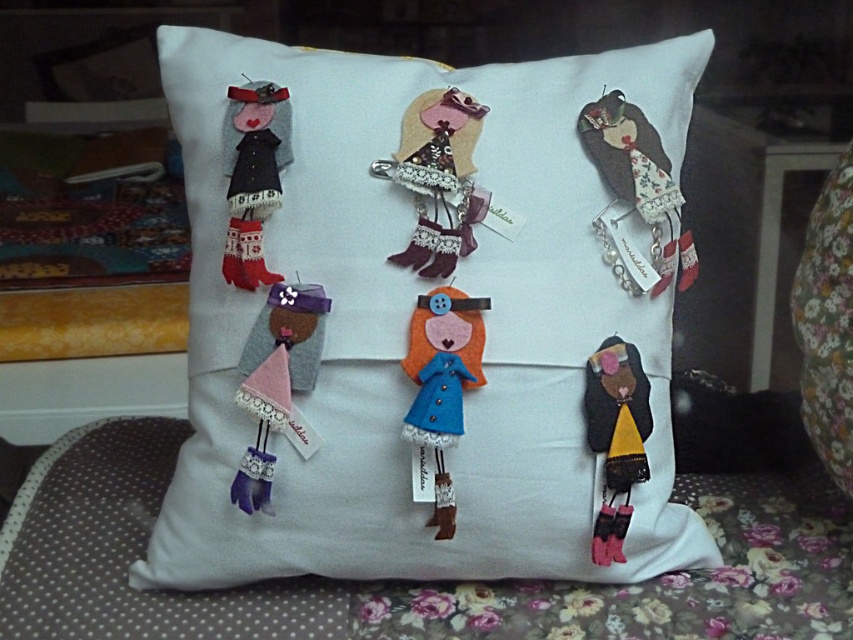
Question: Which point is closer to the camera?

Choices:
 (A) dark brown felt doll at lower right
 (B) white felt pillow at center
 (C) brown felt doll at upper right
 (D) blue felt doll at center

Answer: (D)

Question: Which of these objects is positioned closest to the blue felt doll at center?

Choices:
 (A) brown felt doll at upper right
 (B) pink felt doll at center
 (C) felt doll at upper left

Answer: (B)

Question: In this image, where is white felt pillow at center located relative to brown felt doll at upper right?

Choices:
 (A) above
 (B) below

Answer: (B)

Question: Based on their relative distances, which object is farther from the white felt pillow at center?

Choices:
 (A) blue felt doll at center
 (B) felt doll at upper left
 (C) brown felt doll at upper right

Answer: (C)

Question: Can you confirm if pink felt doll at center is bigger than felt doll at upper left?

Choices:
 (A) yes
 (B) no

Answer: (B)

Question: Is brown felt doll at upper right to the right of blue felt doll at center from the viewer's perspective?

Choices:
 (A) yes
 (B) no

Answer: (A)